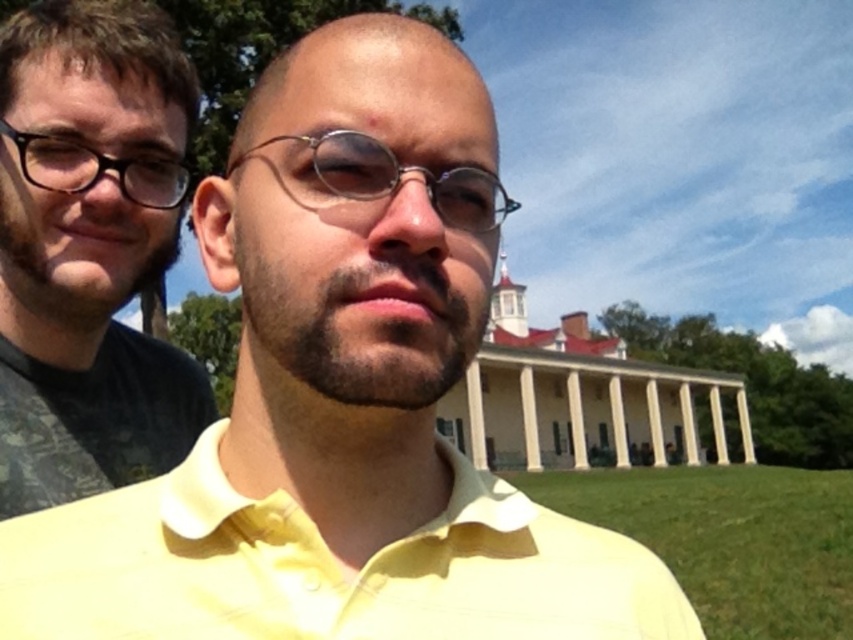
Does metallic round glasses at center appear under matte black glasses at left?

Correct, metallic round glasses at center is located below matte black glasses at left.

Who is higher up, metallic round glasses at center or matte black glasses at left?

matte black glasses at left

At what (x,y) coordinates should I click in order to perform the action: click on metallic round glasses at center. Please return your answer as a coordinate pair (x, y). This screenshot has width=853, height=640. Looking at the image, I should click on (399, 179).

Is yellow cotton polo shirt at center wider than matte black shirt at left?

Yes.

Between point (155, 634) and point (213, 406), which one is positioned in front?

Positioned in front is point (155, 634).

This screenshot has height=640, width=853. I want to click on yellow cotton polo shirt at center, so click(323, 566).

This screenshot has width=853, height=640. Describe the element at coordinates (90, 250) in the screenshot. I see `matte black shirt at left` at that location.

Is matte black shirt at left closer to camera compared to metallic round glasses at center?

No.

You are a GUI agent. You are given a task and a screenshot of the screen. Output one action in this format:
    pyautogui.click(x=<x>, y=<y>)
    Task: Click on the matte black shirt at left
    Image resolution: width=853 pixels, height=640 pixels.
    Given the screenshot: What is the action you would take?
    pyautogui.click(x=90, y=250)

Find the location of `matte black shirt at left`. matte black shirt at left is located at coordinates (90, 250).